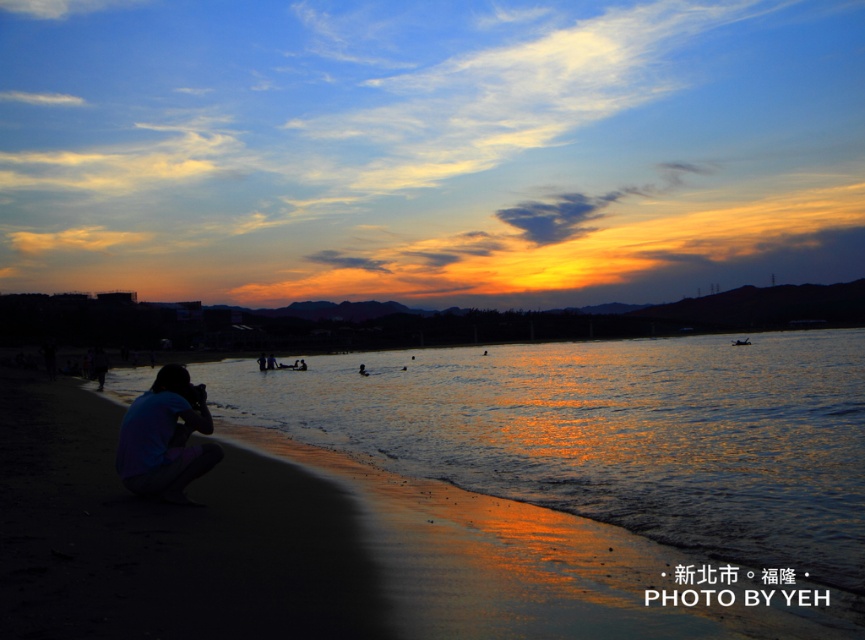
Question: Which point is farther from the camera taking this photo?

Choices:
 (A) (850, 465)
 (B) (184, 502)

Answer: (A)

Question: Does glistening water at lower left have a greater width compared to blue cotton shirt at lower left?

Choices:
 (A) no
 (B) yes

Answer: (B)

Question: Is glistening water at lower left positioned before blue cotton shirt at lower left?

Choices:
 (A) yes
 (B) no

Answer: (A)

Question: Which object is farther from the camera taking this photo?

Choices:
 (A) blue cotton shirt at lower left
 (B) glistening water at lower left

Answer: (A)

Question: Can you confirm if glistening water at lower left is bigger than blue cotton shirt at lower left?

Choices:
 (A) no
 (B) yes

Answer: (B)